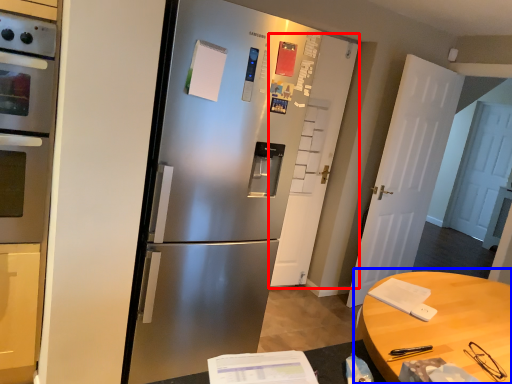
Question: Among these objects, which one is farthest to the camera, door (highlighted by a red box) or table (highlighted by a blue box)?

Choices:
 (A) door
 (B) table

Answer: (A)